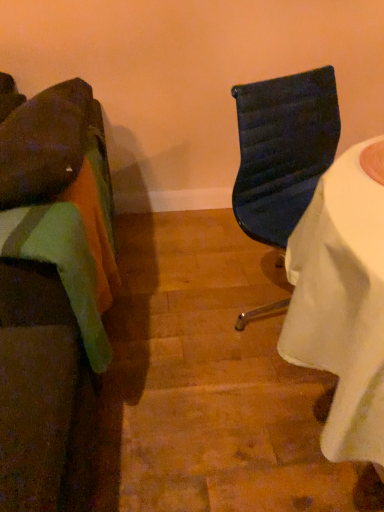
Question: From the image's perspective, is matte black chair at center, placed as the 1th chair when sorted from right to left, over velvet green cushion at left, the 1th chair in the left-to-right sequence?

Choices:
 (A) no
 (B) yes

Answer: (B)

Question: Does matte black chair at center, placed as the 1th chair when sorted from right to left, have a greater height compared to velvet green cushion at left, the 1th chair in the left-to-right sequence?

Choices:
 (A) yes
 (B) no

Answer: (A)

Question: Does matte black chair at center, which is the second chair from left to right, have a larger size compared to velvet green cushion at left, marked as the 2th chair in a right-to-left arrangement?

Choices:
 (A) yes
 (B) no

Answer: (A)

Question: From a real-world perspective, is matte black chair at center, which is the second chair from left to right, below velvet green cushion at left, marked as the 2th chair in a right-to-left arrangement?

Choices:
 (A) no
 (B) yes

Answer: (A)

Question: Does matte black chair at center, placed as the 1th chair when sorted from right to left, have a lesser width compared to velvet green cushion at left, marked as the 2th chair in a right-to-left arrangement?

Choices:
 (A) yes
 (B) no

Answer: (A)

Question: Is matte black chair at center, which is the second chair from left to right, turned away from velvet green cushion at left, marked as the 2th chair in a right-to-left arrangement?

Choices:
 (A) no
 (B) yes

Answer: (A)

Question: From a real-world perspective, is velvet green cushion at left, the 1th chair in the left-to-right sequence, physically above matte black chair at center, which is the second chair from left to right?

Choices:
 (A) no
 (B) yes

Answer: (A)

Question: Are velvet green cushion at left, marked as the 2th chair in a right-to-left arrangement, and matte black chair at center, placed as the 1th chair when sorted from right to left, beside each other?

Choices:
 (A) yes
 (B) no

Answer: (B)

Question: Considering the relative sizes of velvet green cushion at left, marked as the 2th chair in a right-to-left arrangement, and matte black chair at center, placed as the 1th chair when sorted from right to left, in the image provided, is velvet green cushion at left, marked as the 2th chair in a right-to-left arrangement, taller than matte black chair at center, placed as the 1th chair when sorted from right to left,?

Choices:
 (A) no
 (B) yes

Answer: (A)

Question: Is velvet green cushion at left, the 1th chair in the left-to-right sequence, smaller than matte black chair at center, which is the second chair from left to right?

Choices:
 (A) no
 (B) yes

Answer: (B)

Question: Does velvet green cushion at left, the 1th chair in the left-to-right sequence, have a greater width compared to matte black chair at center, placed as the 1th chair when sorted from right to left?

Choices:
 (A) no
 (B) yes

Answer: (B)

Question: Is velvet green cushion at left, marked as the 2th chair in a right-to-left arrangement, to the left of matte black chair at center, which is the second chair from left to right, from the viewer's perspective?

Choices:
 (A) no
 (B) yes

Answer: (B)

Question: In the image, is velvet green cushion at left, marked as the 2th chair in a right-to-left arrangement, on the left side or the right side of matte black chair at center, which is the second chair from left to right?

Choices:
 (A) left
 (B) right

Answer: (A)